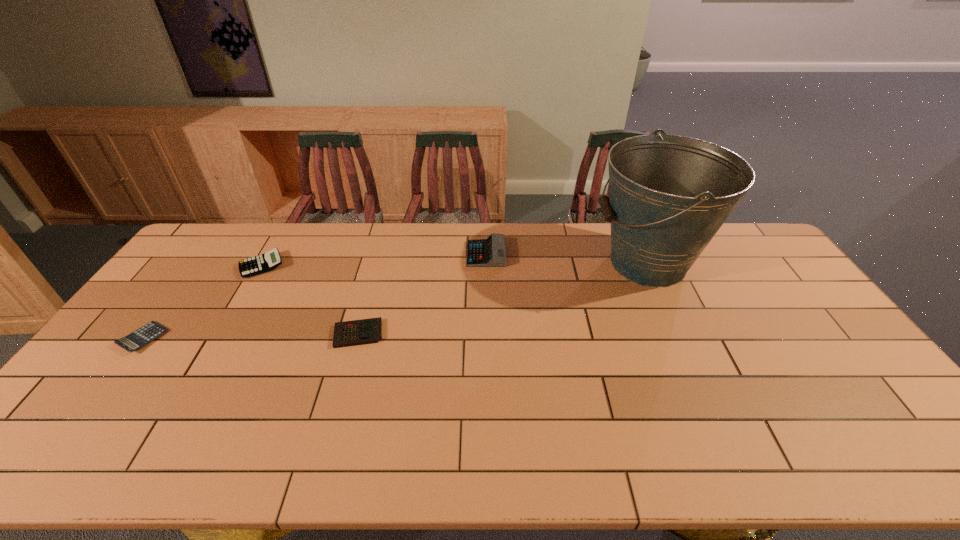
At what (x,y) coordinates should I click in order to perform the action: click on vacant space located with the handle on opposite sides of the bucket. Please return your answer as a coordinate pair (x, y). Looking at the image, I should click on (485, 264).

Find the location of a particular element. free spot located 0.250m with the handle on opposite sides of the bucket is located at coordinates (516, 264).

Locate an element on the screen. The height and width of the screenshot is (540, 960). vacant region located 0.090m with the handle on opposite sides of the bucket is located at coordinates (564, 264).

Identify the location of free location located on the front of the second tallest object. The width and height of the screenshot is (960, 540). (487, 309).

The image size is (960, 540). What are the coordinates of `vacant area situated 0.140m on the right of the third shortest object` in the screenshot? It's located at (325, 266).

I want to click on vacant space located 0.340m on the front of the second shortest object, so click(x=321, y=468).

Locate an element on the screen. Image resolution: width=960 pixels, height=540 pixels. free space located on the right of the shortest object is located at coordinates (234, 338).

The height and width of the screenshot is (540, 960). In order to click on bucket located in the far edge section of the desktop in this screenshot , I will do `click(669, 195)`.

Locate an element on the screen. The image size is (960, 540). object located at the left edge is located at coordinates (141, 337).

Locate an element on the screen. The image size is (960, 540). free space at the far edge of the desktop is located at coordinates (288, 235).